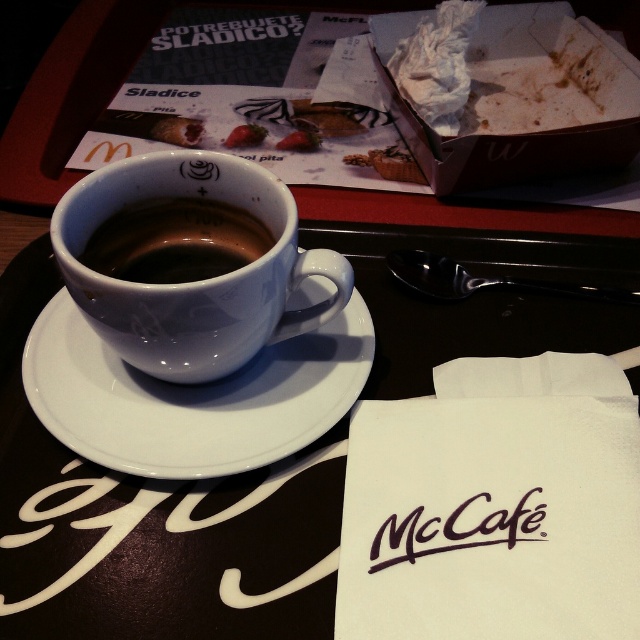
Is white ceramic saucer at center to the left of white glossy mug at upper center from the viewer's perspective?

Indeed, white ceramic saucer at center is positioned on the left side of white glossy mug at upper center.

The image size is (640, 640). I want to click on white ceramic saucer at center, so click(192, 397).

Who is more distant from viewer, (320, 408) or (186, 173)?

The point (186, 173) is behind.

Find the location of a particular element. white ceramic saucer at center is located at coordinates (192, 397).

Which of these two, white ceramic saucer at center or black paper napkin at lower center, stands taller?

With more height is white ceramic saucer at center.

Does point (182, 436) come farther from viewer compared to point (458, 522)?

That is True.

The image size is (640, 640). I want to click on white ceramic saucer at center, so click(192, 397).

Is point (433, 545) more distant than point (253, 145)?

No, it is not.

Does black paper napkin at lower center appear on the left side of smooth strawberry at center?

No, black paper napkin at lower center is not to the left of smooth strawberry at center.

Between point (540, 516) and point (228, 141), which one is positioned behind?

Point (228, 141)

The height and width of the screenshot is (640, 640). What are the coordinates of `black paper napkin at lower center` in the screenshot? It's located at (456, 529).